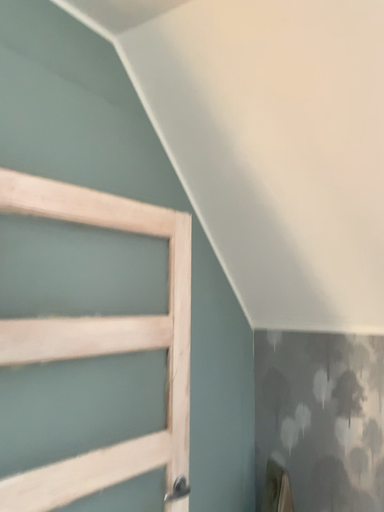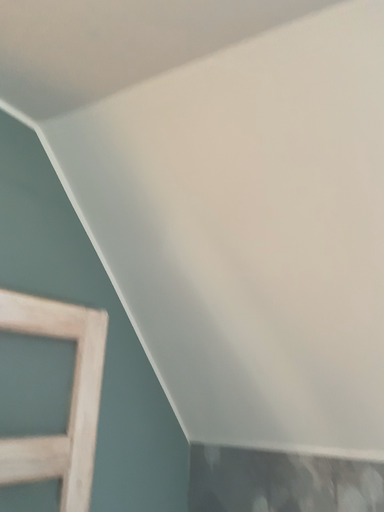
Question: How did the camera likely rotate when shooting the video?

Choices:
 (A) rotated upward
 (B) rotated downward

Answer: (A)